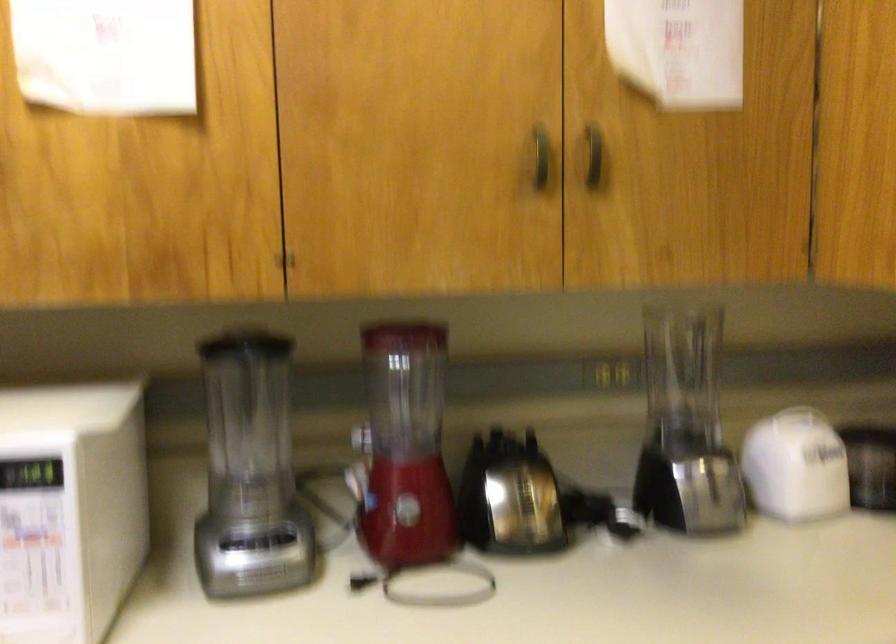
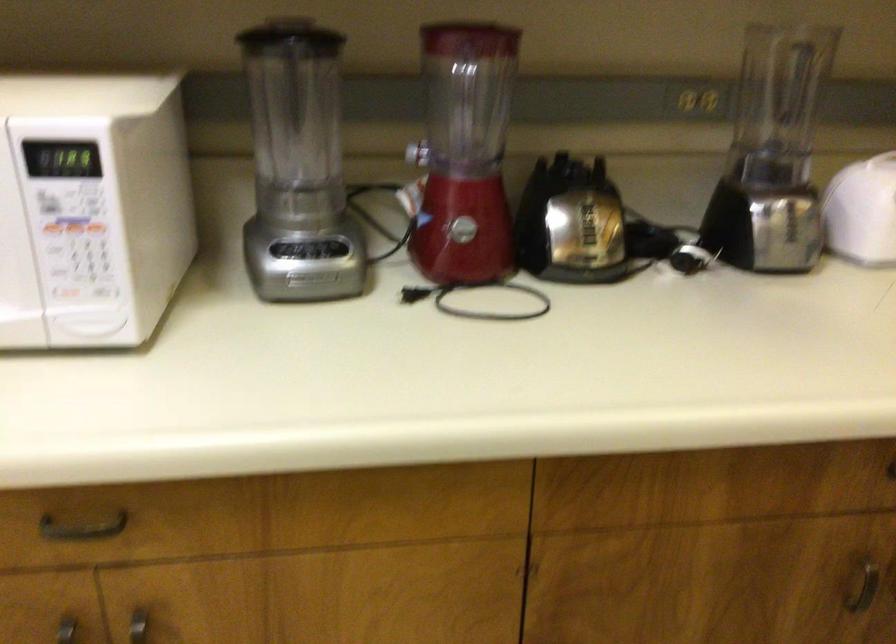
In the second image, find the point that corresponds to [410,386] in the first image.

(467, 93)